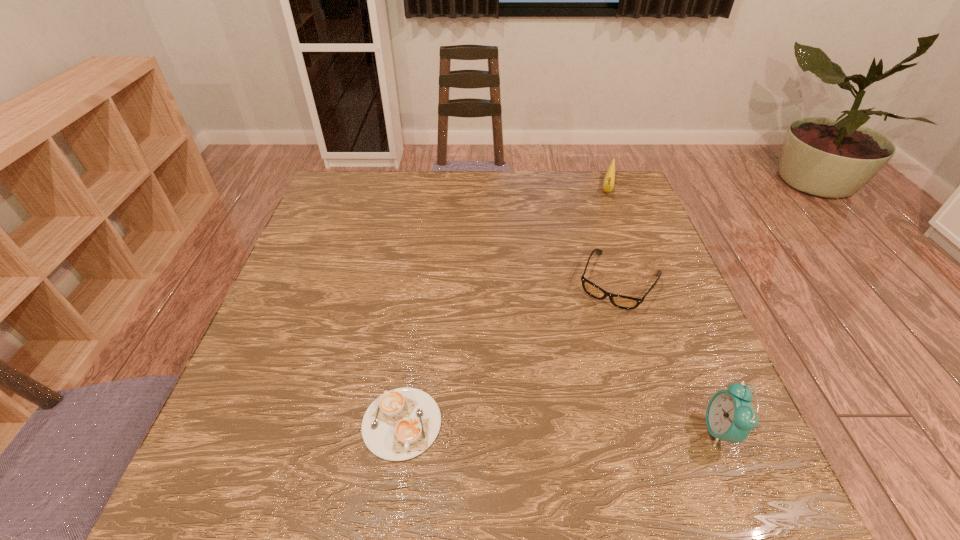
You are a GUI agent. You are given a task and a screenshot of the screen. Output one action in this format:
    pyautogui.click(x=<x>, y=<y>)
    Task: Click on the free space on the desktop that is between the leftmost object and the tallest object and is positioned on the front-facing side of the third tallest object
    The height and width of the screenshot is (540, 960).
    Given the screenshot: What is the action you would take?
    pyautogui.click(x=542, y=426)

Identify the location of free space on the desktop that is between the shortest object and the tallest object and is positioned at the stem of the banana. (560, 427).